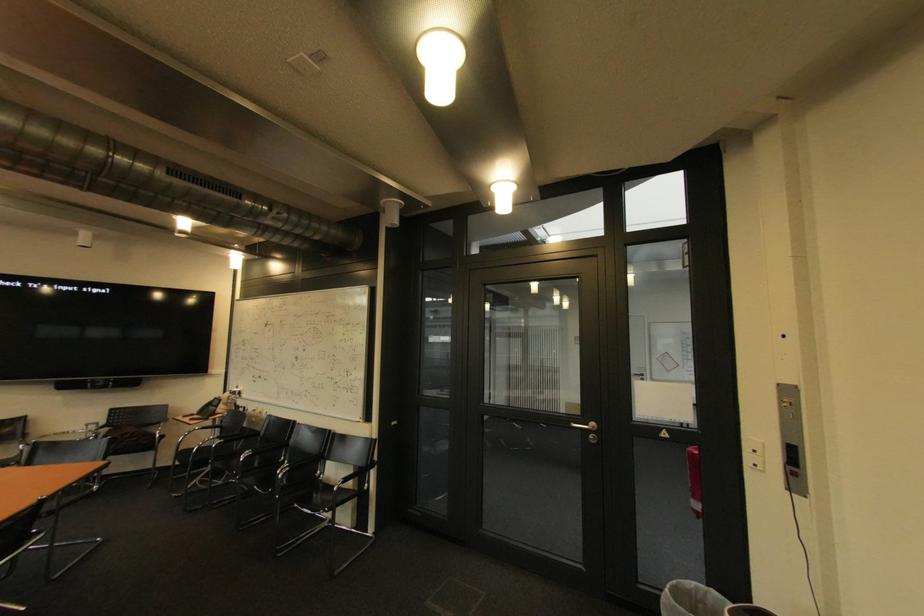
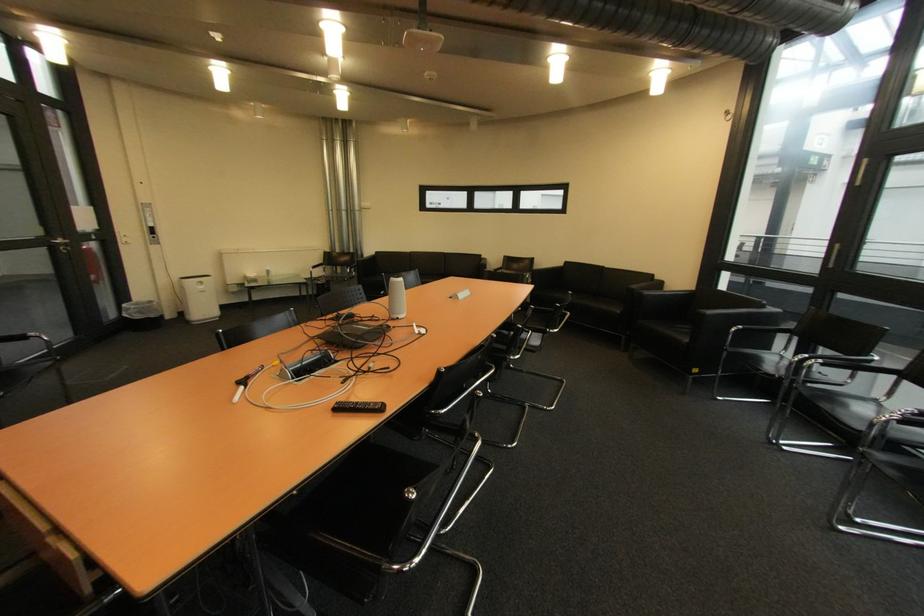
Where in the second image is the point corresponding to the point at 601,426 from the first image?

(68, 241)